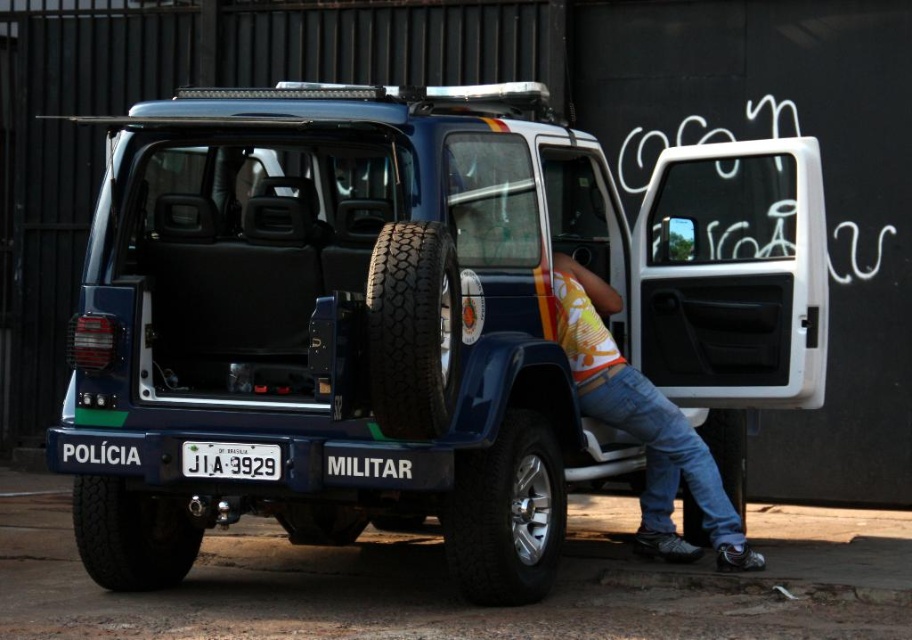
Does point (396, 394) lie behind point (189, 464)?

That is False.

Between point (416, 332) and point (230, 465), which one is positioned in front?

Point (416, 332)

What do you see at coordinates (412, 330) in the screenshot?
I see `black rubber tire at center` at bounding box center [412, 330].

Where is `black rubber tire at center`? The height and width of the screenshot is (640, 912). black rubber tire at center is located at coordinates (412, 330).

Does shiny metallic tire at lower center appear over black rubber tire at lower right?

Yes.

Who is more forward, (x=504, y=588) or (x=719, y=436)?

Positioned in front is point (x=504, y=588).

Is point (494, 563) positioned in front of point (701, 426)?

Yes.

This screenshot has width=912, height=640. What are the coordinates of `shiny metallic tire at lower center` in the screenshot? It's located at (506, 515).

Does black rubber tire at lower right appear over white plastic license plate at center?

No, black rubber tire at lower right is not above white plastic license plate at center.

Describe the element at coordinates (728, 452) in the screenshot. I see `black rubber tire at lower right` at that location.

Is point (691, 496) behind point (247, 456)?

Yes, point (691, 496) is farther from viewer.

Locate an element on the screen. black rubber tire at lower right is located at coordinates (728, 452).